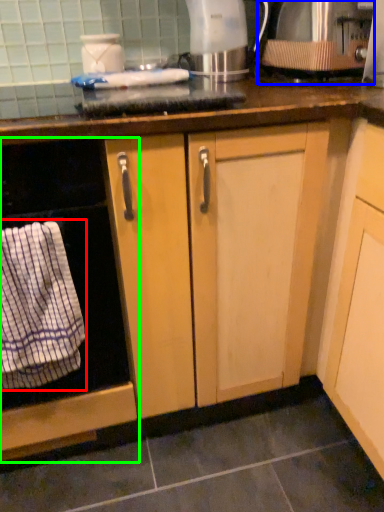
Question: Based on their relative distances, which object is farther from bath towel (highlighted by a red box)? Choose from kitchen appliance (highlighted by a blue box) and home appliance (highlighted by a green box).

Choices:
 (A) kitchen appliance
 (B) home appliance

Answer: (A)